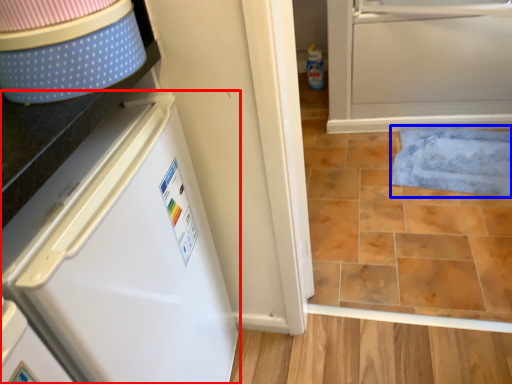
Question: Which object is further to the camera taking this photo, refrigerator (highlighted by a red box) or bath mat (highlighted by a blue box)?

Choices:
 (A) refrigerator
 (B) bath mat

Answer: (B)